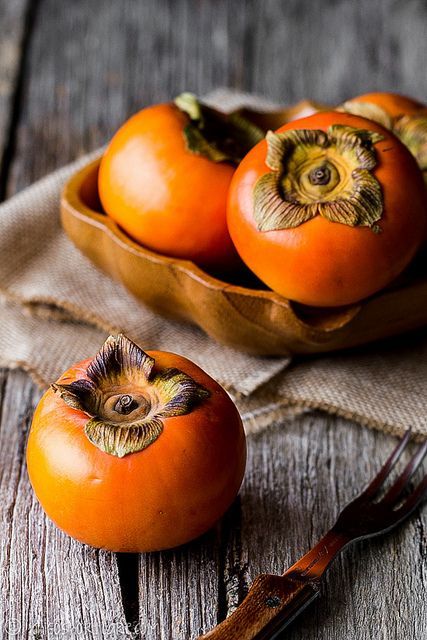
This screenshot has width=427, height=640. What are the coordinates of `grain of wood` in the screenshot? It's located at (42, 593), (31, 585), (11, 523), (29, 513).